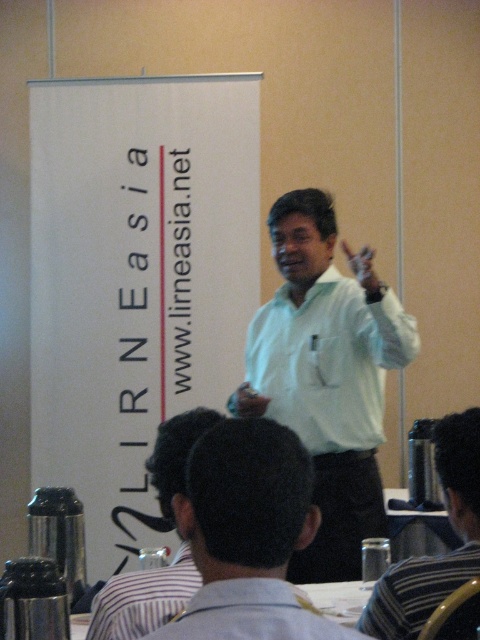
Does white shirt at center lie in front of white matte shirt at center?

Yes, white shirt at center is in front of white matte shirt at center.

Who is taller, white shirt at center or white matte shirt at center?

white matte shirt at center is taller.

Locate an element on the screen. The image size is (480, 640). white shirt at center is located at coordinates (248, 536).

Can you confirm if white matte shirt at center is taller than striped fabric shirt at center?

Yes.

Does white matte shirt at center lie in front of striped fabric shirt at center?

No, white matte shirt at center is further to the viewer.

Does point (235, 412) come farther from viewer compared to point (459, 476)?

That is True.

At what (x,y) coordinates should I click in order to perform the action: click on white matte shirt at center. Please return your answer as a coordinate pair (x, y). The height and width of the screenshot is (640, 480). Looking at the image, I should click on (328, 360).

Who is shorter, light green shirt at center or striped fabric shirt at center?

Standing shorter between the two is striped fabric shirt at center.

Is point (333, 218) in front of point (463, 426)?

No, it is behind (463, 426).

Identify the location of light green shirt at center. The image size is (480, 640). (326, 376).